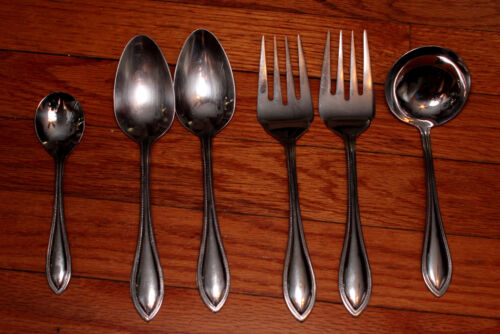
Locate an element on the screen. horizontal wood slata is located at coordinates (483, 55), (472, 132), (477, 198), (476, 275), (413, 322).